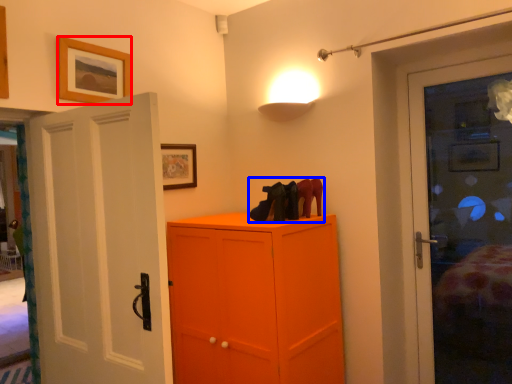
Question: Which point is further to the camera, picture frame (highlighted by a red box) or footwear (highlighted by a blue box)?

Choices:
 (A) picture frame
 (B) footwear

Answer: (B)